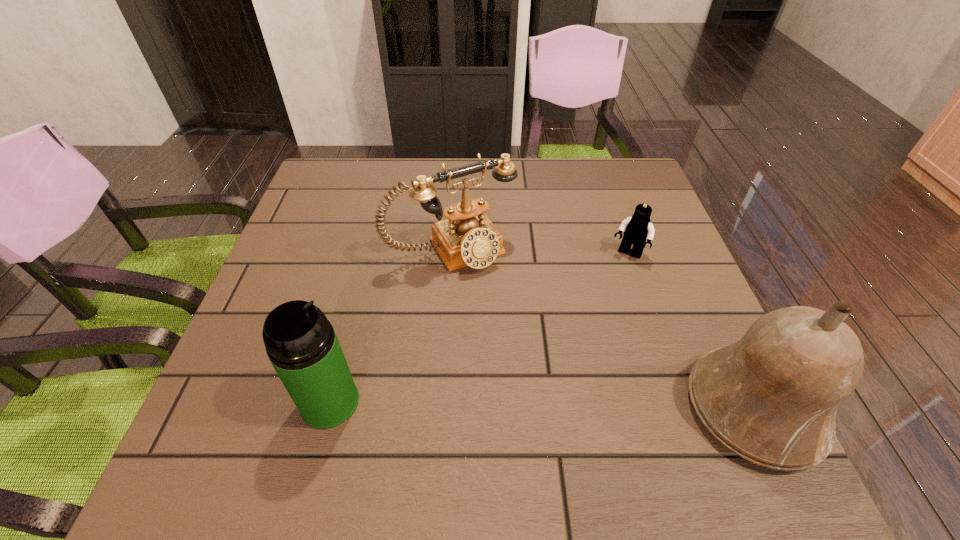
Where is `empty space between the thermos bottle and the third tallest object`? This screenshot has height=540, width=960. empty space between the thermos bottle and the third tallest object is located at coordinates (391, 325).

Identify the location of free space between the Lego and the second shortest object. This screenshot has height=540, width=960. (540, 252).

What are the coordinates of `free spot between the bell and the thermos bottle` in the screenshot? It's located at (541, 405).

Find the location of `empty space that is in between the bell and the telephone`. empty space that is in between the bell and the telephone is located at coordinates (603, 328).

You are a GUI agent. You are given a task and a screenshot of the screen. Output one action in this format:
    pyautogui.click(x=<x>, y=<y>)
    Task: Click on the vacant point located between the shortest object and the telephone
    This screenshot has width=960, height=540.
    Given the screenshot: What is the action you would take?
    pyautogui.click(x=540, y=252)

Where is `vacant region between the bell and the Lego`? vacant region between the bell and the Lego is located at coordinates (690, 332).

Locate which object is the closest to the thermos bottle. Please provide its 2D coordinates. Your answer should be formatted as a tuple, i.e. [(x, y)], where the tuple contains the x and y coordinates of a point satisfying the conditions above.

[(467, 237)]

The height and width of the screenshot is (540, 960). Find the location of `object identified as the third closest to the bell`. object identified as the third closest to the bell is located at coordinates (301, 344).

You are a GUI agent. You are given a task and a screenshot of the screen. Output one action in this format:
    pyautogui.click(x=<x>, y=<y>)
    Task: Click on the free location that satisfies the following two spatial constraints: 1. on the front side of the Lego; 2. on the right side of the second shortest object
    Image resolution: width=960 pixels, height=540 pixels.
    Given the screenshot: What is the action you would take?
    pyautogui.click(x=451, y=255)

I want to click on vacant area that satisfies the following two spatial constraints: 1. on the front side of the telephone; 2. on the right side of the Lego, so click(451, 255).